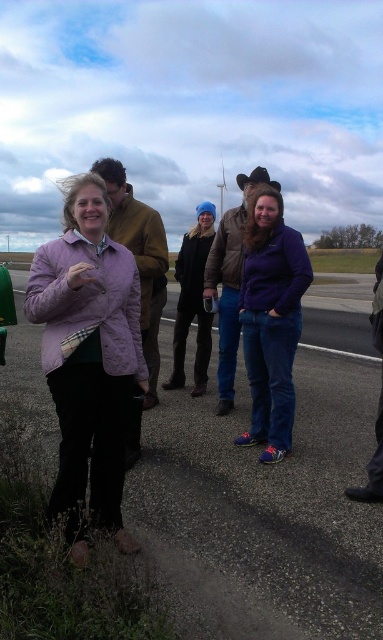
Question: Considering the relative positions of smooth asphalt road at center and purple matte jacket at center in the image provided, where is smooth asphalt road at center located with respect to purple matte jacket at center?

Choices:
 (A) above
 (B) below

Answer: (B)

Question: Which point is closer to the camera?

Choices:
 (A) (52, 516)
 (B) (255, 536)

Answer: (A)

Question: Which of the following is the farthest from the observer?

Choices:
 (A) purple matte jacket at center
 (B) smooth asphalt road at center

Answer: (A)

Question: Is matte purple jacket at center in front of purple matte jacket at center?

Choices:
 (A) no
 (B) yes

Answer: (B)

Question: Among these objects, which one is nearest to the camera?

Choices:
 (A) smooth asphalt road at center
 (B) purple matte jacket at center

Answer: (A)

Question: Observing the image, what is the correct spatial positioning of matte purple jacket at center in reference to purple matte jacket at center?

Choices:
 (A) left
 (B) right

Answer: (A)